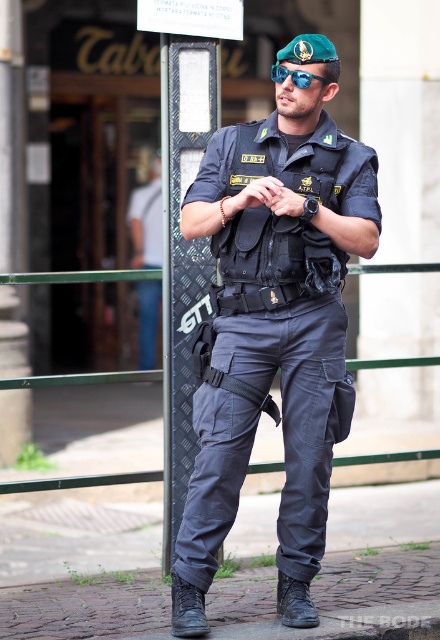
Question: Can you confirm if matte black uniform at center is smaller than blue reflective lens goggles at center?

Choices:
 (A) yes
 (B) no

Answer: (A)

Question: Does matte black uniform at center appear on the right side of blue reflective lens goggles at center?

Choices:
 (A) yes
 (B) no

Answer: (B)

Question: Which point is closer to the camera taking this photo?

Choices:
 (A) (187, 508)
 (B) (308, 84)

Answer: (A)

Question: Considering the relative positions of matte black uniform at center and blue reflective lens goggles at center in the image provided, where is matte black uniform at center located with respect to blue reflective lens goggles at center?

Choices:
 (A) below
 (B) above

Answer: (A)